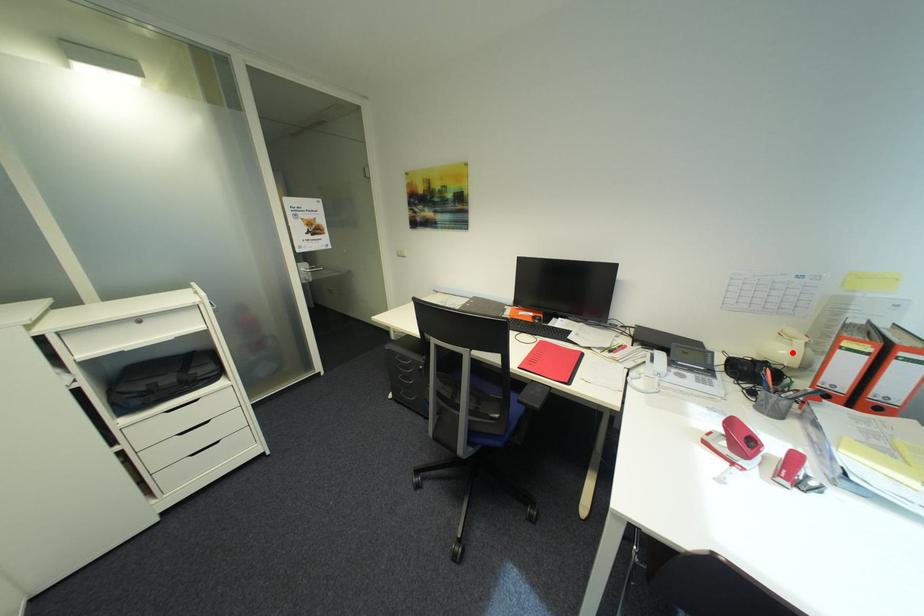
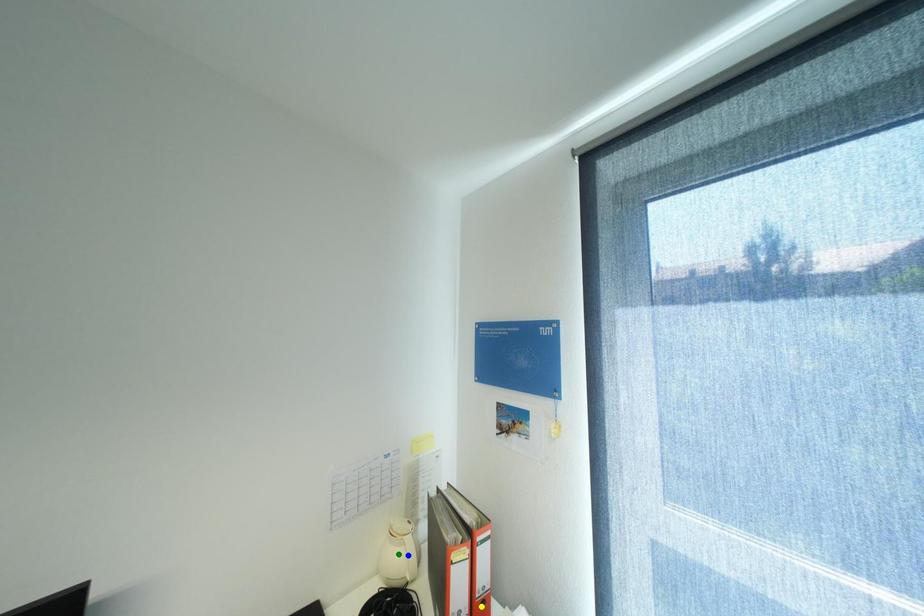
Question: I am providing you with two images of the same scene from different viewpoints. A red point is marked on the first image. You are given multiple points on the second image. Which spot in image 2 lines up with the point in image 1?

Choices:
 (A) yellow point
 (B) blue point
 (C) green point

Answer: (B)